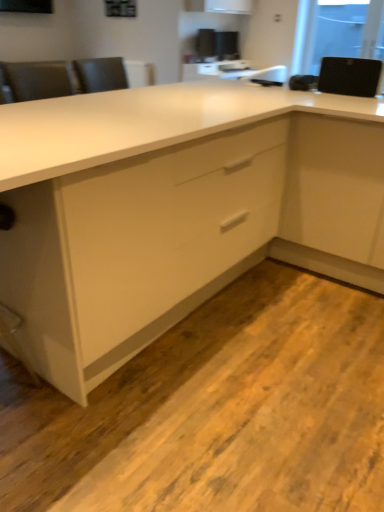
What is the approximate width of white glossy cabinet at center?

7.81 feet.

Find the location of a particular element. The height and width of the screenshot is (512, 384). transparent glass window screen at upper right is located at coordinates (341, 30).

You are a GUI agent. You are given a task and a screenshot of the screen. Output one action in this format:
    pyautogui.click(x=<x>, y=<y>)
    Task: Click on the white glossy cabinet at center
    
    Given the screenshot: What is the action you would take?
    pyautogui.click(x=171, y=207)

Considering their positions, is white glossy cabinet at center located in front of or behind black matte speaker at upper right?

Visually, white glossy cabinet at center is located in front of black matte speaker at upper right.

From a real-world perspective, is white glossy cabinet at center positioned above or below black matte speaker at upper right?

In terms of real-world spatial position, white glossy cabinet at center is below black matte speaker at upper right.

Is white glossy cabinet at center far from black matte speaker at upper right?

That's right, there is a large distance between white glossy cabinet at center and black matte speaker at upper right.

Is white glossy cabinet at center oriented away from black matte speaker at upper right?

white glossy cabinet at center does not have its back to black matte speaker at upper right.

From the image's perspective, which object appears higher, black matte speaker at upper right or transparent glass window screen at upper right?

transparent glass window screen at upper right appears higher in the image.

Is point (366, 94) less distant than point (347, 17)?

Yes, point (366, 94) is closer to viewer.

Which is more to the right, black matte speaker at upper right or transparent glass window screen at upper right?

From the viewer's perspective, transparent glass window screen at upper right appears more on the right side.

From a real-world perspective, is black matte speaker at upper right positioned above or below transparent glass window screen at upper right?

black matte speaker at upper right is situated lower than transparent glass window screen at upper right in the real world.

From a real-world perspective, is transparent glass window screen at upper right positioned above or below black matte speaker at upper right?

In terms of real-world spatial position, transparent glass window screen at upper right is above black matte speaker at upper right.

Considering the positions of point (372, 2) and point (334, 82), is point (372, 2) closer or farther from the camera than point (334, 82)?

Point (372, 2) is positioned farther from the camera compared to point (334, 82).

Considering the relative sizes of transparent glass window screen at upper right and black matte speaker at upper right in the image provided, is transparent glass window screen at upper right taller than black matte speaker at upper right?

Correct, transparent glass window screen at upper right is much taller as black matte speaker at upper right.

I want to click on window screen that appears above the black matte speaker at upper right (from a real-world perspective), so click(x=341, y=30).

Which is farther from the camera, (x=362, y=244) or (x=367, y=17)?

The point (x=367, y=17) is farther.

From the picture: Can you confirm if white glossy cabinet at center is thinner than transparent glass window screen at upper right?

In fact, white glossy cabinet at center might be wider than transparent glass window screen at upper right.

Could you tell me if white glossy cabinet at center is turned towards transparent glass window screen at upper right?

No, white glossy cabinet at center is not oriented towards transparent glass window screen at upper right.

Does white glossy cabinet at center lie behind transparent glass window screen at upper right?

No.

Considering their positions, is transparent glass window screen at upper right located in front of or behind white glossy cabinet at center?

transparent glass window screen at upper right is behind white glossy cabinet at center.

Which is more to the right, transparent glass window screen at upper right or white glossy cabinet at center?

From the viewer's perspective, transparent glass window screen at upper right appears more on the right side.

Do you think transparent glass window screen at upper right is within white glossy cabinet at center, or outside of it?

transparent glass window screen at upper right is located beyond the bounds of white glossy cabinet at center.

Does black matte speaker at upper right turn towards white glossy cabinet at center?

Yes, black matte speaker at upper right is facing white glossy cabinet at center.

Would you say black matte speaker at upper right is inside or outside white glossy cabinet at center?

black matte speaker at upper right can be found inside white glossy cabinet at center.

How much distance is there between black matte speaker at upper right and white glossy cabinet at center?

black matte speaker at upper right is 1.15 meters away from white glossy cabinet at center.

From a real-world perspective, who is located lower, black matte speaker at upper right or white glossy cabinet at center?

From a 3D spatial view, white glossy cabinet at center is below.

This screenshot has height=512, width=384. I want to click on cabinetry to the left of black matte speaker at upper right, so click(x=171, y=207).

Locate an element on the screen. Image resolution: width=384 pixels, height=512 pixels. window screen behind the black matte speaker at upper right is located at coordinates (341, 30).

Considering their positions, is white glossy cabinet at center positioned further to black matte speaker at upper right than transparent glass window screen at upper right?

transparent glass window screen at upper right is further to black matte speaker at upper right.

Based on their spatial positions, is white glossy cabinet at center or black matte speaker at upper right further from transparent glass window screen at upper right?

white glossy cabinet at center is further to transparent glass window screen at upper right.

Based on their spatial positions, is black matte speaker at upper right or white glossy cabinet at center further from transparent glass window screen at upper right?

The object further to transparent glass window screen at upper right is white glossy cabinet at center.

Considering their positions, is black matte speaker at upper right positioned closer to white glossy cabinet at center than transparent glass window screen at upper right?

black matte speaker at upper right is positioned closer to the anchor white glossy cabinet at center.

From the image, which object appears to be farther from white glossy cabinet at center, transparent glass window screen at upper right or black matte speaker at upper right?

transparent glass window screen at upper right is further to white glossy cabinet at center.

Consider the image. When comparing their distances from black matte speaker at upper right, does transparent glass window screen at upper right or white glossy cabinet at center seem further?

The object further to black matte speaker at upper right is transparent glass window screen at upper right.

Where is `appliance between white glossy cabinet at center and transparent glass window screen at upper right along the z-axis`? This screenshot has width=384, height=512. appliance between white glossy cabinet at center and transparent glass window screen at upper right along the z-axis is located at coordinates (350, 76).